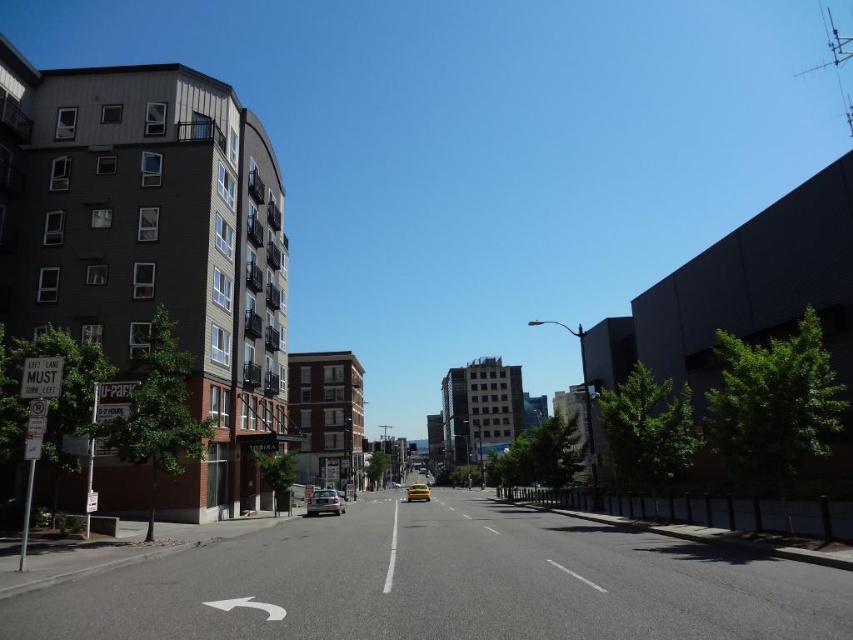
From the picture: Can you confirm if silver metallic sedan at center is positioned to the left of yellow matte taxi at center?

Indeed, silver metallic sedan at center is positioned on the left side of yellow matte taxi at center.

Does point (328, 512) come closer to viewer compared to point (415, 493)?

Yes, point (328, 512) is closer to viewer.

Locate an element on the screen. silver metallic sedan at center is located at coordinates (323, 502).